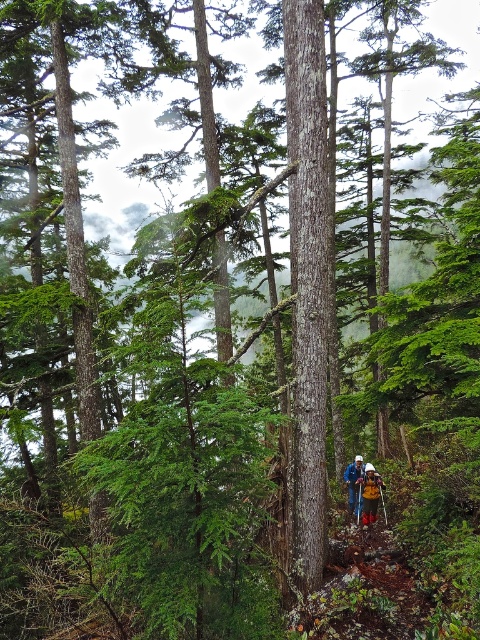
Is yellow fabric backpack at center wider than camouflage jacket at lower center?

Correct, the width of yellow fabric backpack at center exceeds that of camouflage jacket at lower center.

Can you confirm if yellow fabric backpack at center is thinner than camouflage jacket at lower center?

No, yellow fabric backpack at center is not thinner than camouflage jacket at lower center.

You are a GUI agent. You are given a task and a screenshot of the screen. Output one action in this format:
    pyautogui.click(x=<x>, y=<y>)
    Task: Click on the yellow fabric backpack at center
    The image size is (480, 640).
    Given the screenshot: What is the action you would take?
    pyautogui.click(x=370, y=493)